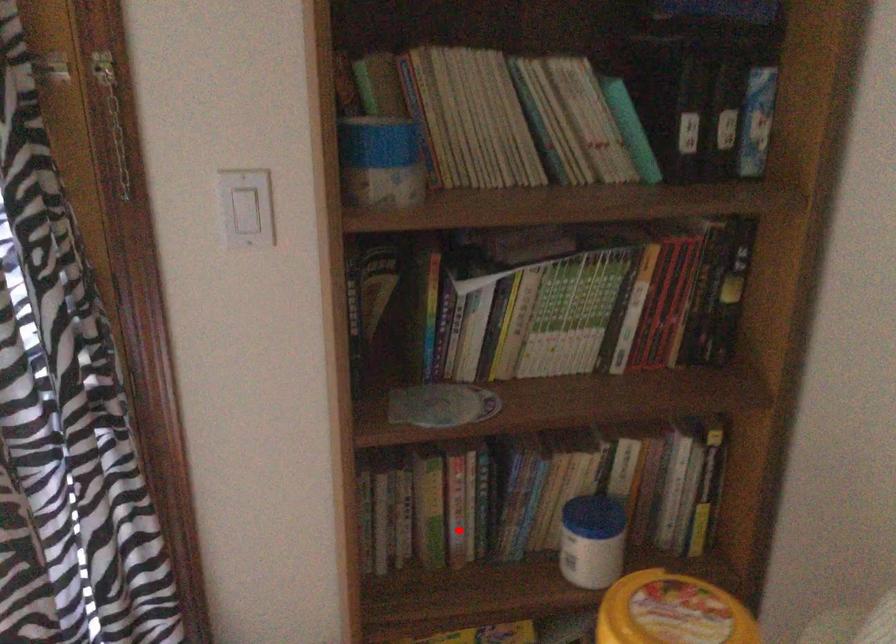
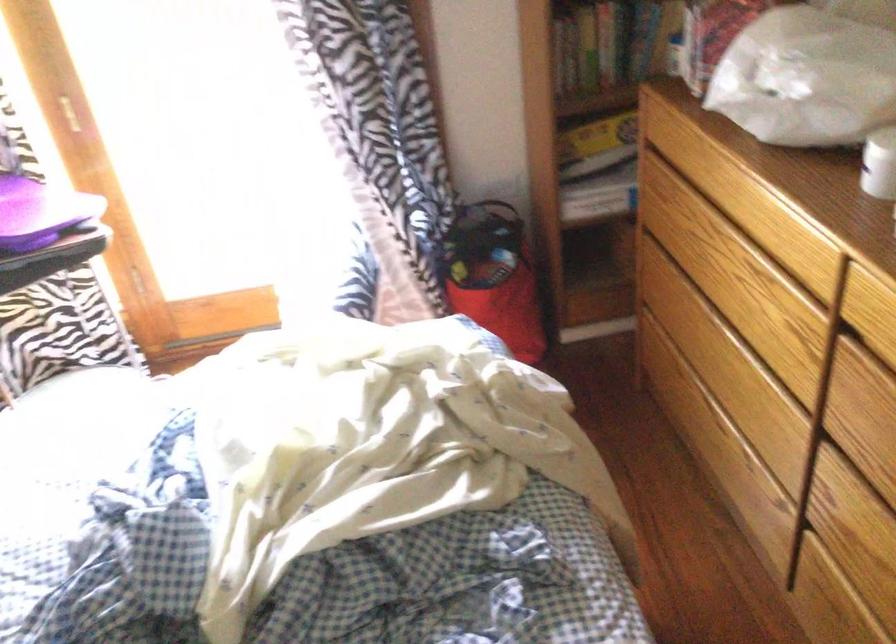
Question: I am providing you with two images of the same scene from different viewpoints. Image1 has a red point marked. In image2, the corresponding 3D location appears at what relative position? Reply with the corresponding letter.

Choices:
 (A) Closer
 (B) Farther

Answer: (B)